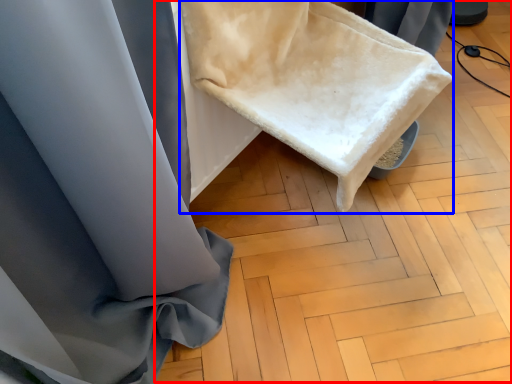
Question: Which of the following is the closest to the observer, wood (highlighted by a red box) or wide (highlighted by a blue box)?

Choices:
 (A) wood
 (B) wide

Answer: (B)